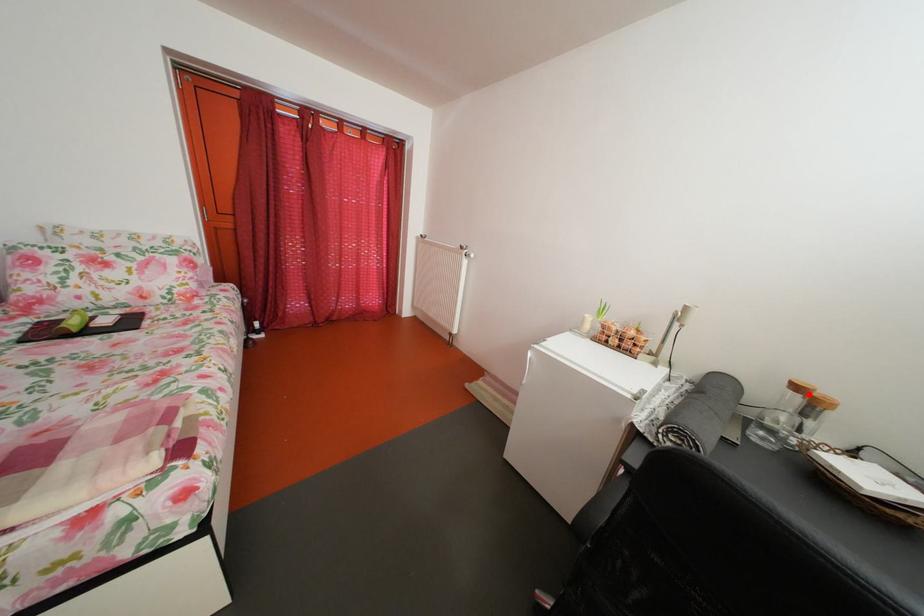
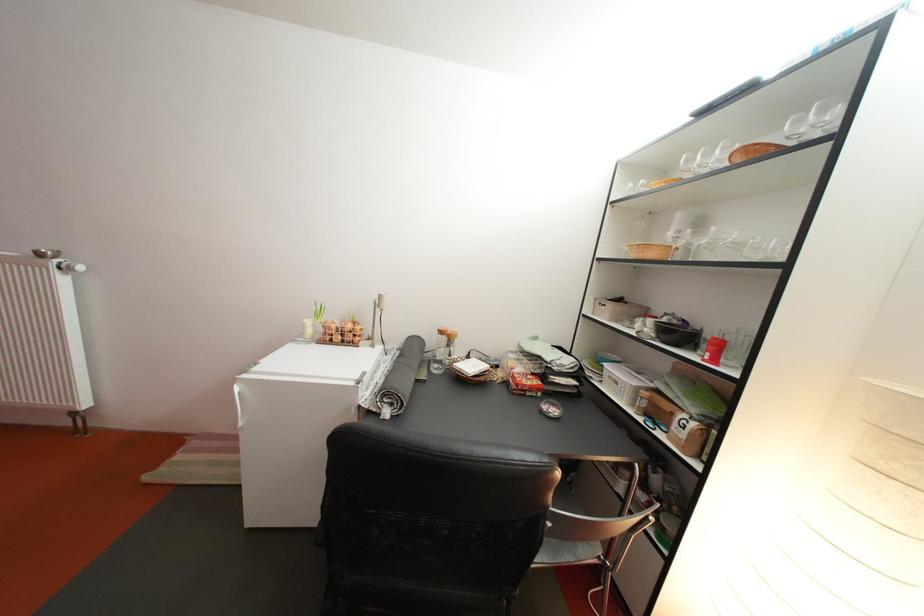
Locate, in the second image, the point that corresponds to the highlighted location in the first image.

(453, 339)